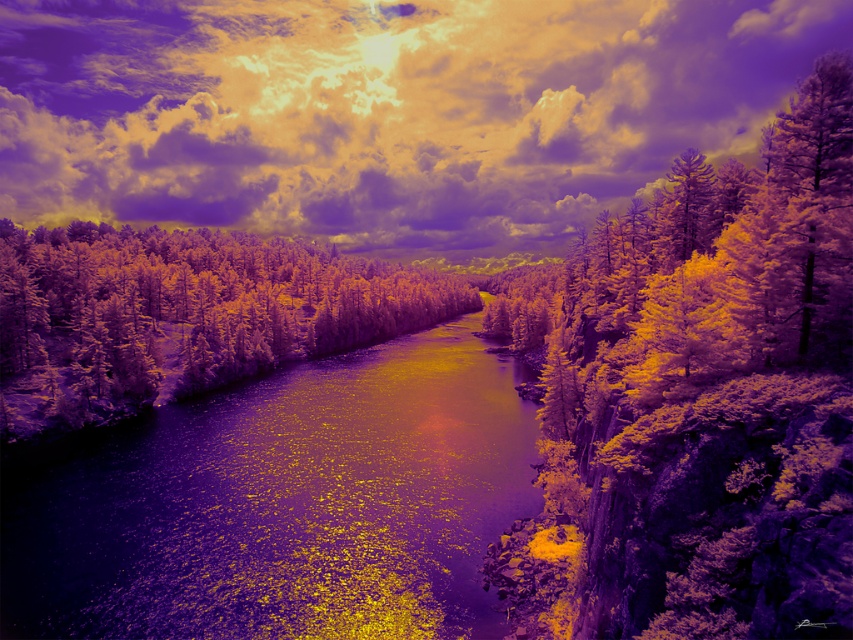
You are an artist analyzing this surreal landscape. You notice the cloudy sky at upper center and the shiny metallic river at center. Which object is positioned higher in the image?

The cloudy sky at upper center is positioned higher than the shiny metallic river at center.

You are standing at the edge of the surreal landscape, looking towards the river that flows from the bottom left to the top right. There is a specific point marked at coordinates point (x=259, y=211). If you want to reach this point as quickly as possible, should you walk towards the left or the right along the riverbank?

The point (x=259, y=211) is 729.19 meters away from the viewer, so you should walk towards the right along the riverbank to reach it quickly.

You are a photographer planning to capture the cloudy sky at upper center in the image. Based on its position, what are the coordinates where you should focus your camera?

The cloudy sky at upper center is located at coordinates point (384,112), so you should focus your camera there.